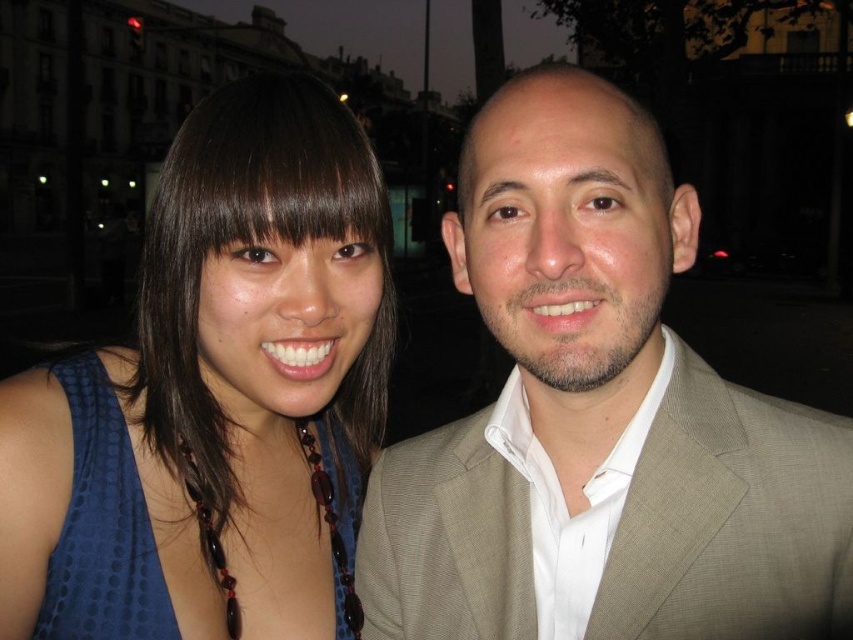
How far apart are blue dotted fabric dress at left and brown hair at upper center?

A distance of 27.69 inches exists between blue dotted fabric dress at left and brown hair at upper center.

Does blue dotted fabric dress at left appear over brown hair at upper center?

No.

Does point (125, 556) lie in front of point (607, 97)?

No.

Locate an element on the screen. blue dotted fabric dress at left is located at coordinates click(x=102, y=525).

Looking at this image, is tan textured suit at center wider than brown hair at upper center?

Yes.

Describe the element at coordinates (599, 419) in the screenshot. I see `tan textured suit at center` at that location.

Which is behind, point (514, 572) or point (653, 170)?

Positioned behind is point (514, 572).

At what (x,y) coordinates should I click in order to perform the action: click on tan textured suit at center. Please return your answer as a coordinate pair (x, y). The image size is (853, 640). Looking at the image, I should click on (599, 419).

Between tan textured suit at center and blue dotted fabric dress at left, which one is positioned higher?

tan textured suit at center is higher up.

Is point (740, 417) farther from viewer compared to point (56, 547)?

No, (740, 417) is in front of (56, 547).

Is point (749, 602) farther from viewer compared to point (357, 502)?

That is False.

In order to click on tan textured suit at center in this screenshot , I will do tap(599, 419).